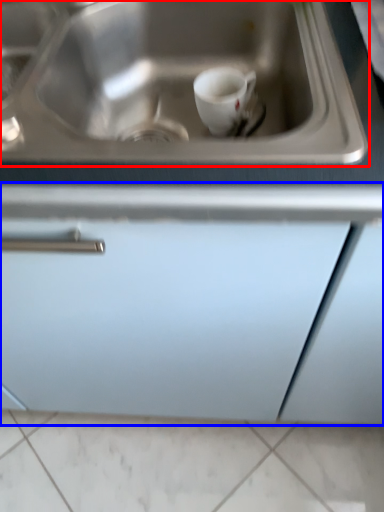
Question: Which object is further to the camera taking this photo, sink (highlighted by a red box) or cabinetry (highlighted by a blue box)?

Choices:
 (A) sink
 (B) cabinetry

Answer: (A)